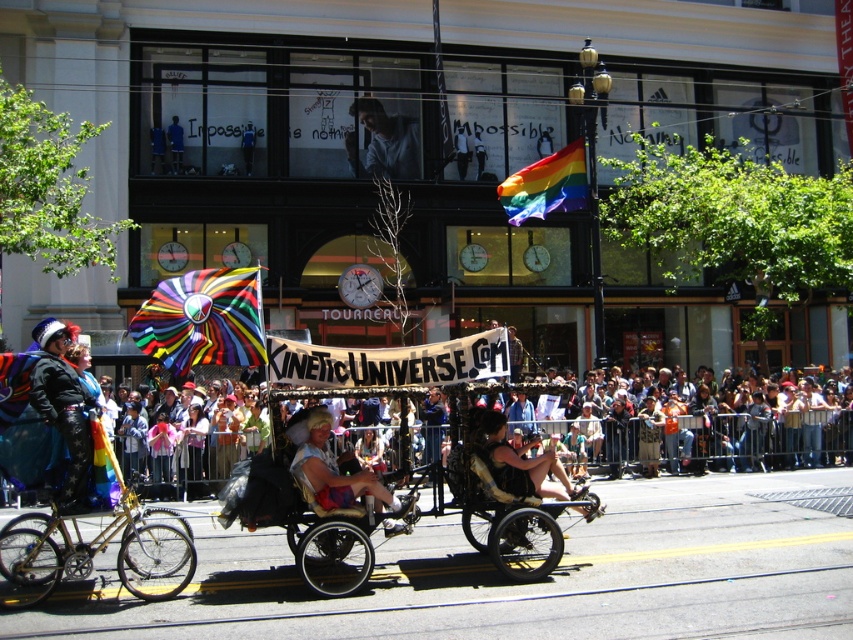
Does metallic gold tricycle at center have a greater width compared to blonde hair wig at center?

Indeed, metallic gold tricycle at center has a greater width compared to blonde hair wig at center.

Who is more distant from viewer, (524, 513) or (303, 448)?

The point (524, 513) is more distant.

You are a GUI agent. You are given a task and a screenshot of the screen. Output one action in this format:
    pyautogui.click(x=<x>, y=<y>)
    Task: Click on the metallic gold tricycle at center
    
    Given the screenshot: What is the action you would take?
    pyautogui.click(x=399, y=467)

Where is `metallic gold tricycle at center`? metallic gold tricycle at center is located at coordinates (399, 467).

Is metallic gold tricycle at center thinner than leather jacket at center?

Incorrect, metallic gold tricycle at center's width is not less than leather jacket at center's.

Can you confirm if metallic gold tricycle at center is positioned below leather jacket at center?

Yes, metallic gold tricycle at center is below leather jacket at center.

The height and width of the screenshot is (640, 853). What do you see at coordinates (399, 467) in the screenshot?
I see `metallic gold tricycle at center` at bounding box center [399, 467].

I want to click on metallic gold tricycle at center, so click(399, 467).

Who is positioned more to the right, shiny metallic bicycle at left or blonde hair wig at center?

blonde hair wig at center is more to the right.

Is shiny metallic bicycle at left above blonde hair wig at center?

Actually, shiny metallic bicycle at left is below blonde hair wig at center.

The width and height of the screenshot is (853, 640). What do you see at coordinates (96, 547) in the screenshot?
I see `shiny metallic bicycle at left` at bounding box center [96, 547].

This screenshot has width=853, height=640. Identify the location of shiny metallic bicycle at left. (96, 547).